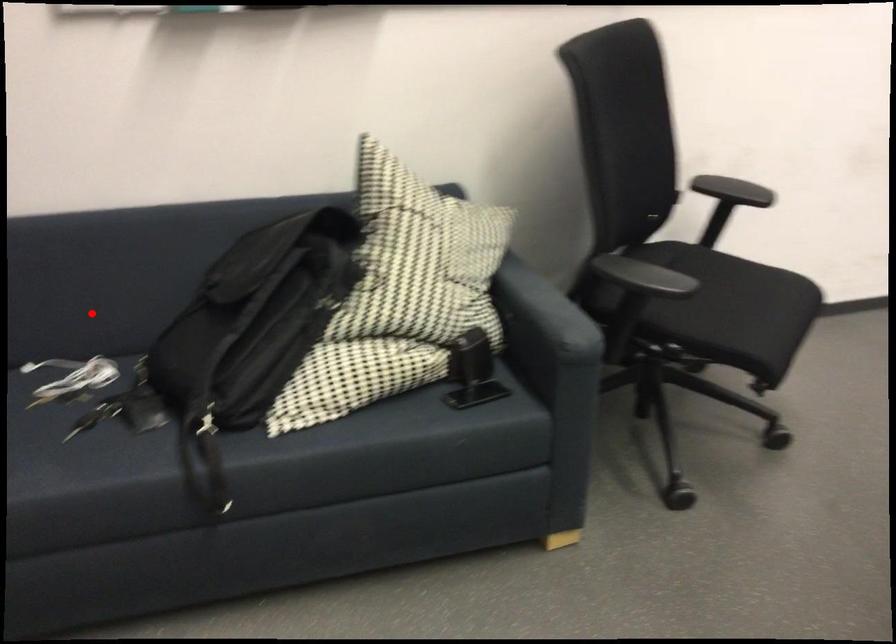
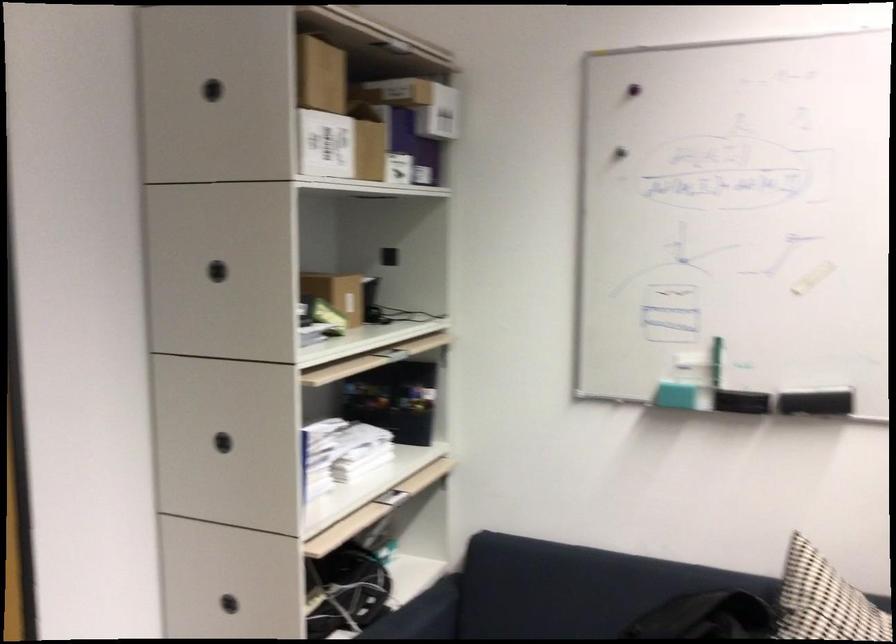
Question: A red point is marked in image1. In image2, is the corresponding 3D point closer to the camera or farther? Reply with the corresponding letter.

Choices:
 (A) The corresponding 3D point is closer.
 (B) The corresponding 3D point is farther.

Answer: (B)